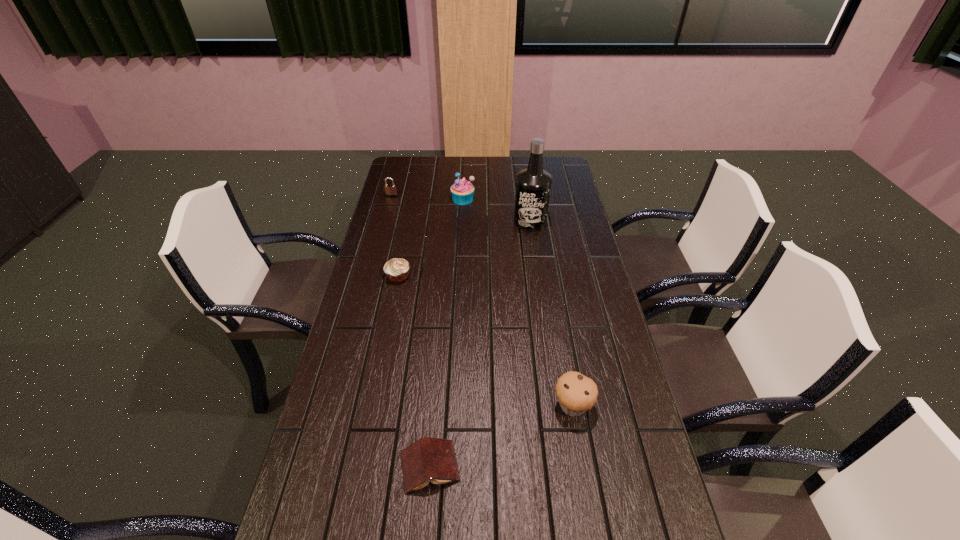
Find the location of a particular element. empty space that is in between the nearest muffin and the padlock is located at coordinates (482, 301).

Where is `free spot between the fifth farthest object and the fifth tallest object`? The height and width of the screenshot is (540, 960). free spot between the fifth farthest object and the fifth tallest object is located at coordinates (486, 341).

This screenshot has width=960, height=540. I want to click on vacant space that's between the second muffin from left to right and the padlock, so (427, 198).

The width and height of the screenshot is (960, 540). Identify the location of free space between the farthest muffin and the rightmost muffin. (517, 302).

Find the location of a particular element. empty space between the fifth farthest object and the padlock is located at coordinates (482, 301).

The image size is (960, 540). I want to click on free space between the fourth tallest object and the farthest muffin, so click(x=427, y=198).

Point out which object is positioned as the third nearest to the nearest muffin. Please provide its 2D coordinates. Your answer should be formatted as a tuple, i.e. [(x, y)], where the tuple contains the x and y coordinates of a point satisfying the conditions above.

[(533, 184)]

At what (x,y) coordinates should I click in order to perform the action: click on object that is the fourth closest to the fourth farthest object. Please return your answer as a coordinate pair (x, y). Looking at the image, I should click on (428, 459).

I want to click on the second closest muffin to the rightmost muffin, so click(462, 191).

Locate an element on the screen. The image size is (960, 540). muffin object that ranks as the second closest to the fifth farthest object is located at coordinates (462, 191).